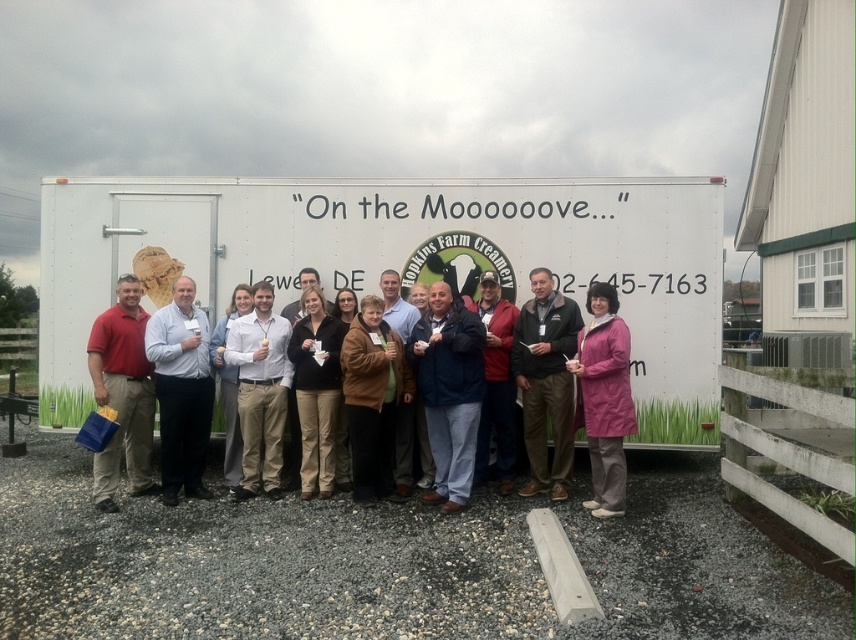
You are a photographer trying to capture both the matte red shirt at left and the brown fuzzy jacket at center in a single shot. Based on their positions, which person should you focus on first to ensure both are in frame?

The matte red shirt at left is above the brown fuzzy jacket at center, so focusing on the person in the matte red shirt at left first would ensure both are included in the frame.

You are a photographer trying to capture a photo of the group in front of the trailer. You want to ensure both the dark blue jacket at center and the pink matte coat at center are visible. Which person should be on the left side in the photo?

The dark blue jacket at center should be on the left side in the photo because it is positioned on the left side of the pink matte coat at center.